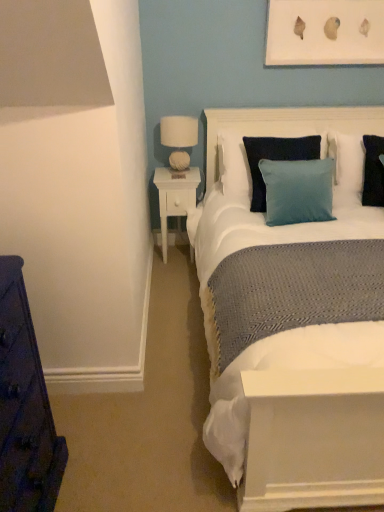
Question: Considering the relative sizes of white fabric lampshade at upper right and black matte pillow at right, the second pillow when ordered from back to front, in the image provided, is white fabric lampshade at upper right wider than black matte pillow at right, the second pillow when ordered from back to front,?

Choices:
 (A) no
 (B) yes

Answer: (A)

Question: Are white fabric lampshade at upper right and black matte pillow at right, placed as the first pillow when sorted from front to back, far apart?

Choices:
 (A) yes
 (B) no

Answer: (A)

Question: Is white fabric lampshade at upper right beside black matte pillow at right, placed as the first pillow when sorted from front to back?

Choices:
 (A) yes
 (B) no

Answer: (B)

Question: Can you confirm if white fabric lampshade at upper right is smaller than black matte pillow at right, placed as the first pillow when sorted from front to back?

Choices:
 (A) yes
 (B) no

Answer: (A)

Question: Would you say white fabric lampshade at upper right is outside black matte pillow at right, the second pillow when ordered from back to front?

Choices:
 (A) yes
 (B) no

Answer: (A)

Question: In terms of width, does white fabric headboard at upper center look wider or thinner when compared to white fabric lampshade at upper right?

Choices:
 (A) wide
 (B) thin

Answer: (A)

Question: Would you say white fabric headboard at upper center is inside or outside white fabric lampshade at upper right?

Choices:
 (A) inside
 (B) outside

Answer: (B)

Question: Considering their positions, is white fabric headboard at upper center located in front of or behind white fabric lampshade at upper right?

Choices:
 (A) behind
 (B) front

Answer: (B)

Question: In the image, is white fabric headboard at upper center on the left side or the right side of white fabric lampshade at upper right?

Choices:
 (A) left
 (B) right

Answer: (B)

Question: From a real-world perspective, is blue fabric pillow at upper right, the 1th pillow viewed from the back, positioned above or below black matte pillow at right, the second pillow when ordered from back to front?

Choices:
 (A) above
 (B) below

Answer: (A)

Question: In terms of width, does blue fabric pillow at upper right, the 1th pillow viewed from the back, look wider or thinner when compared to black matte pillow at right, placed as the first pillow when sorted from front to back?

Choices:
 (A) thin
 (B) wide

Answer: (A)

Question: Visually, is blue fabric pillow at upper right, marked as the 2th pillow in a front-to-back arrangement, positioned to the left or to the right of black matte pillow at right, placed as the first pillow when sorted from front to back?

Choices:
 (A) left
 (B) right

Answer: (B)

Question: Do you think blue fabric pillow at upper right, marked as the 2th pillow in a front-to-back arrangement, is within black matte pillow at right, placed as the first pillow when sorted from front to back, or outside of it?

Choices:
 (A) outside
 (B) inside

Answer: (A)

Question: Considering the relative positions of white matte picture frame at upper center and white fabric headboard at upper center in the image provided, is white matte picture frame at upper center to the left or to the right of white fabric headboard at upper center?

Choices:
 (A) right
 (B) left

Answer: (A)

Question: From the image's perspective, is white matte picture frame at upper center positioned above or below white fabric headboard at upper center?

Choices:
 (A) below
 (B) above

Answer: (B)